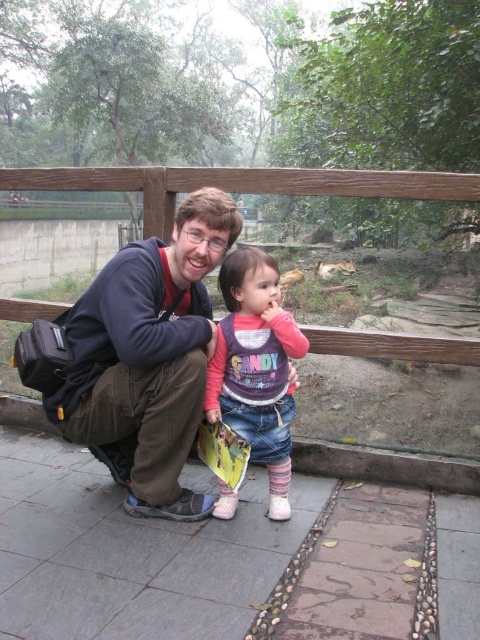
Question: Does matte blue jacket at center come behind matte purple sweater at center?

Choices:
 (A) no
 (B) yes

Answer: (A)

Question: Can you confirm if matte blue jacket at center is bigger than matte purple sweater at center?

Choices:
 (A) no
 (B) yes

Answer: (B)

Question: Which object appears closest to the camera in this image?

Choices:
 (A) matte blue jacket at center
 (B) matte purple sweater at center

Answer: (A)

Question: Can you confirm if matte blue jacket at center is positioned above matte purple sweater at center?

Choices:
 (A) yes
 (B) no

Answer: (A)